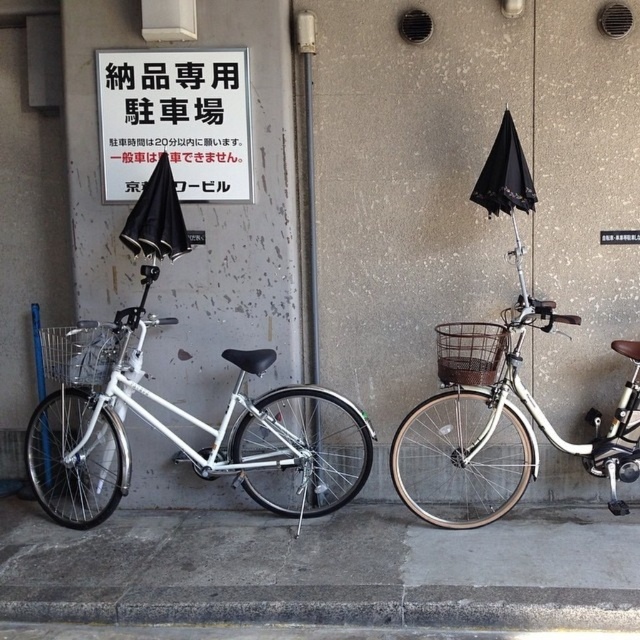
You are a delivery person who needs to place a large package between the white matte bicycle at left and the brown woven basket at center. The package is 1.5 meters long. Can you fit it between them?

The distance between the white matte bicycle at left and the brown woven basket at center is 1.29 meters, which is shorter than the package length of 1.5 meters. Therefore, the package cannot fit between them.

You are a delivery person who needs to secure your black matte umbrella at left to the handlebars of the white matte bicycle at left. Based on the scene, is the umbrella currently positioned in a way that it can be easily attached to the bicycle?

The white matte bicycle at left is located below the black matte umbrella at left, meaning the umbrella is already positioned above the bicycle. This placement allows for easy attachment of the umbrella to the handlebars without needing to reposition it significantly.

You are standing in front of the bicycles parked against the wall. You need to hang a small bag on the handlebars of the white matte bicycle at left. Is the brown woven basket at center in the way of reaching the handlebars?

The white matte bicycle at left is below the brown woven basket at center, so the basket might block access to the handlebars. You may need to move the basket first.